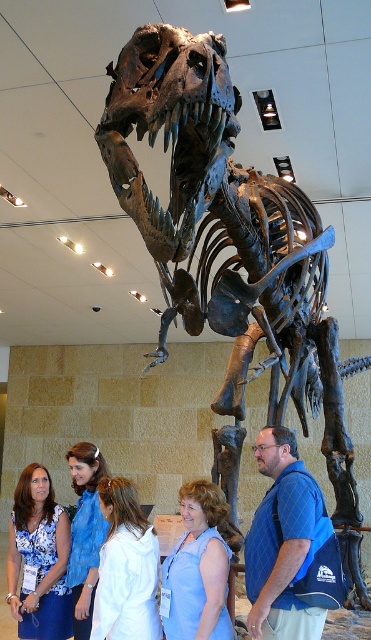
This screenshot has width=371, height=640. I want to click on rusty metal skeleton at center, so click(x=232, y=253).

Is rusty metal skeleton at center bigger than blue denim shirt at lower left?

Yes.

Describe the element at coordinates (232, 253) in the screenshot. I see `rusty metal skeleton at center` at that location.

Where is `rusty metal skeleton at center`? rusty metal skeleton at center is located at coordinates (232, 253).

Does white fabric shirt at center have a smaller size compared to blue denim shirt at lower left?

Incorrect, white fabric shirt at center is not smaller in size than blue denim shirt at lower left.

Locate an element on the screen. white fabric shirt at center is located at coordinates (126, 568).

This screenshot has width=371, height=640. Find the location of `white fabric shirt at center`. white fabric shirt at center is located at coordinates (126, 568).

Does point (290, 608) come in front of point (34, 536)?

Yes, point (290, 608) is closer to viewer.

Find the location of a particular element. blue fabric backpack at center is located at coordinates (290, 547).

Does point (316, 490) lie behind point (12, 609)?

No, (316, 490) is in front of (12, 609).

This screenshot has height=640, width=371. I want to click on blue fabric backpack at center, so click(x=290, y=547).